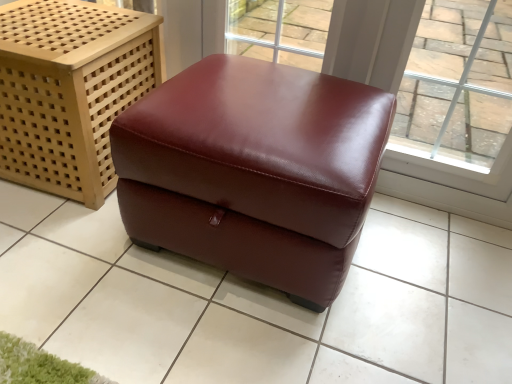
Question: Is burgundy leather ottoman at center, the 2th furniture from the left, positioned beyond the bounds of burgundy leather ottoman at center?

Choices:
 (A) no
 (B) yes

Answer: (B)

Question: Is burgundy leather ottoman at center, the 2th furniture from the left, smaller than burgundy leather ottoman at center?

Choices:
 (A) yes
 (B) no

Answer: (B)

Question: From the image's perspective, does burgundy leather ottoman at center, the 2th furniture from the left, appear lower than burgundy leather ottoman at center?

Choices:
 (A) yes
 (B) no

Answer: (B)

Question: From the image's perspective, is burgundy leather ottoman at center, the 1th furniture from the right, above burgundy leather ottoman at center?

Choices:
 (A) yes
 (B) no

Answer: (A)

Question: Does burgundy leather ottoman at center, the 2th furniture from the left, have a larger size compared to burgundy leather ottoman at center?

Choices:
 (A) no
 (B) yes

Answer: (B)

Question: Is burgundy leather ottoman at center, the 1th furniture from the right, spatially inside burgundy leather ottoman at center, marked as the first furniture in a left-to-right arrangement, or outside of it?

Choices:
 (A) inside
 (B) outside

Answer: (B)

Question: From the image's perspective, relative to burgundy leather ottoman at center, positioned as the second furniture in right-to-left order, is burgundy leather ottoman at center, the 2th furniture from the left, above or below?

Choices:
 (A) below
 (B) above

Answer: (A)

Question: Is burgundy leather ottoman at center, the 2th furniture from the left, taller or shorter than burgundy leather ottoman at center, positioned as the second furniture in right-to-left order?

Choices:
 (A) short
 (B) tall

Answer: (A)

Question: Does point (251, 132) appear closer or farther from the camera than point (53, 109)?

Choices:
 (A) closer
 (B) farther

Answer: (A)

Question: Would you say burgundy leather ottoman at center, marked as the first furniture in a left-to-right arrangement, is to the left or to the right of burgundy leather ottoman at center in the picture?

Choices:
 (A) left
 (B) right

Answer: (A)

Question: Considering the positions of burgundy leather ottoman at center, positioned as the second furniture in right-to-left order, and burgundy leather ottoman at center in the image, is burgundy leather ottoman at center, positioned as the second furniture in right-to-left order, wider or thinner than burgundy leather ottoman at center?

Choices:
 (A) wide
 (B) thin

Answer: (B)

Question: From the image's perspective, relative to burgundy leather ottoman at center, is burgundy leather ottoman at center, positioned as the second furniture in right-to-left order, above or below?

Choices:
 (A) above
 (B) below

Answer: (A)

Question: Is point (2, 144) positioned closer to the camera than point (86, 266)?

Choices:
 (A) farther
 (B) closer

Answer: (A)

Question: Considering their positions, is transparent glass window at upper right located in front of or behind burgundy leather ottoman at center?

Choices:
 (A) front
 (B) behind

Answer: (B)

Question: Is point (482, 155) closer or farther from the camera than point (6, 233)?

Choices:
 (A) closer
 (B) farther

Answer: (B)